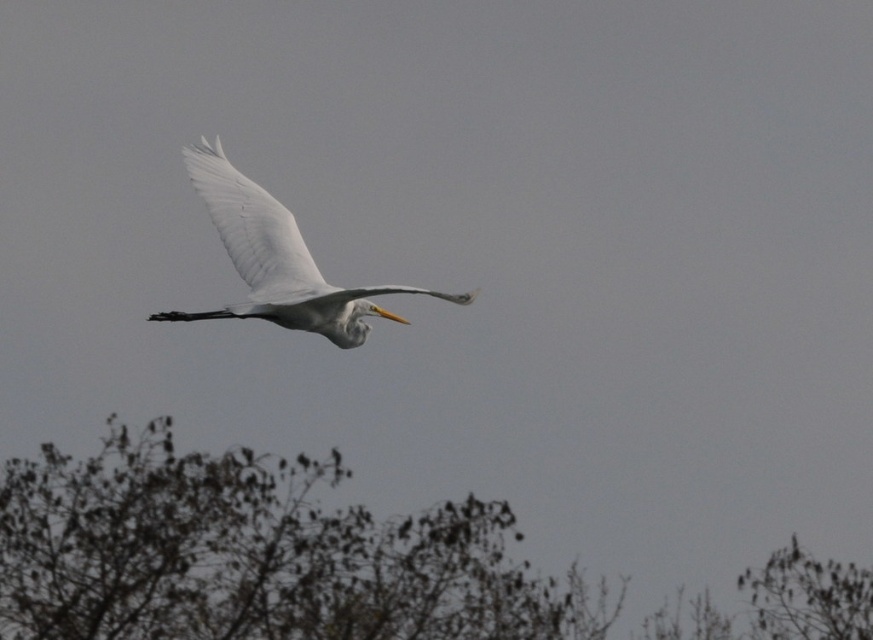
You are a photographer trying to capture the white feathered bird at center while ensuring the brown textured tree at lower center doesn not block the view. Based on their widths, which object should you prioritize keeping in frame to avoid cropping?

The brown textured tree at lower center is wider than the white feathered bird at center. To avoid cropping, prioritize keeping the wider brown textured tree at lower center in frame since it requires more space.

You are a photographer trying to capture the white feathered wing at center and the brown textured tree at lower center in the same frame. Based on their sizes in the image, which object would appear larger in your photo?

Result: The brown textured tree at lower center appears larger in the photo because it is much taller than the white feathered wing at center.

You are a photographer trying to capture the white feathered bird at center and the white feathered wing at center in a single frame. Based on their sizes, which object should you focus on to ensure both are fully visible in your shot?

The white feathered bird at center is wider than the white feathered wing at center, so focusing on the white feathered bird at center will ensure both are fully visible in the shot.